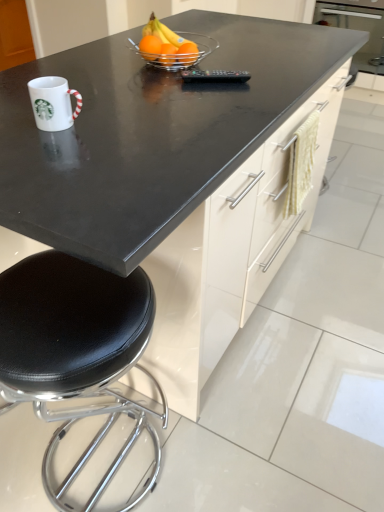
Question: Do you think translucent glass bowl at center is within orange matte at center, acting as the third orange starting from the left, or outside of it?

Choices:
 (A) outside
 (B) inside

Answer: (A)

Question: Based on their positions, is translucent glass bowl at center located to the left or right of orange matte at center, positioned as the 1th orange in right-to-left order?

Choices:
 (A) right
 (B) left

Answer: (B)

Question: Which object is positioned farthest from the orange matte at center, which ranks as the 1th orange in left-to-right order?

Choices:
 (A) black leather stool at lower left
 (B) black plastic remote at center
 (C) orange matte at center, acting as the third orange starting from the left
 (D) orange matte at center, acting as the 2th orange starting from the left
 (E) translucent glass bowl at center

Answer: (A)

Question: Which object is the closest to the black plastic remote at center?

Choices:
 (A) white glossy mug at left
 (B) black leather stool at lower left
 (C) orange matte at center, acting as the 2th orange starting from the left
 (D) orange matte at center, which ranks as the 1th orange in left-to-right order
 (E) orange matte at center, acting as the third orange starting from the left

Answer: (E)